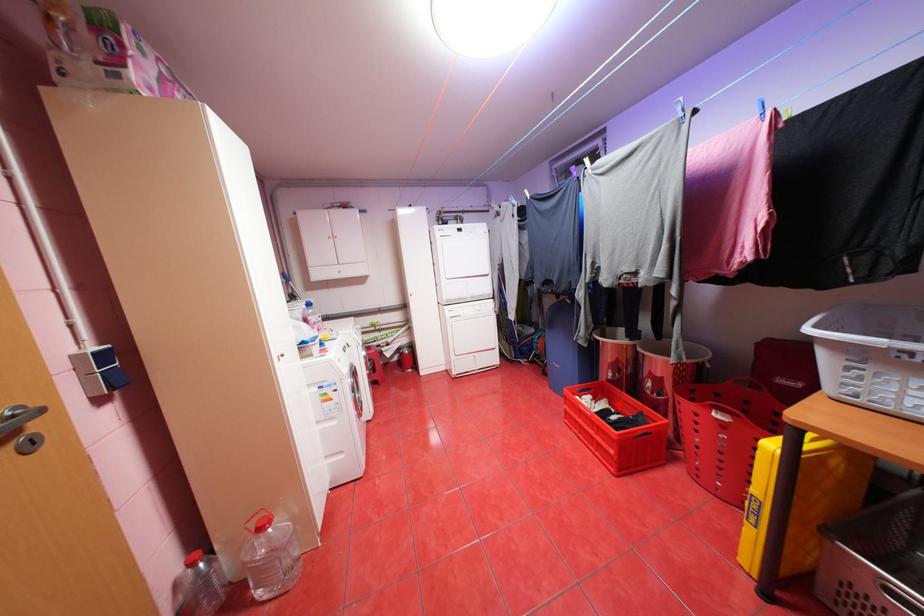
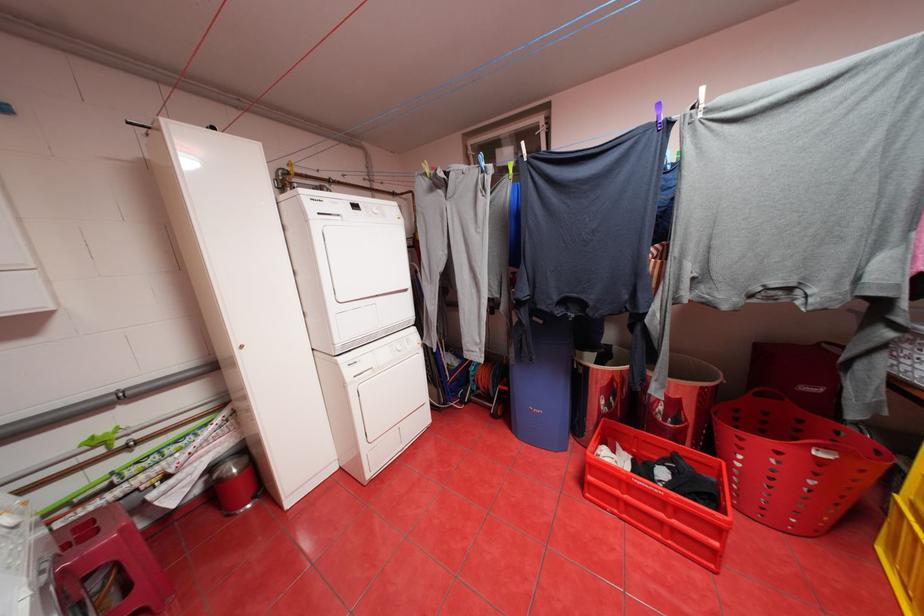
Where in the second image is the point corresponding to the highlighted location from the first image?

(631, 448)